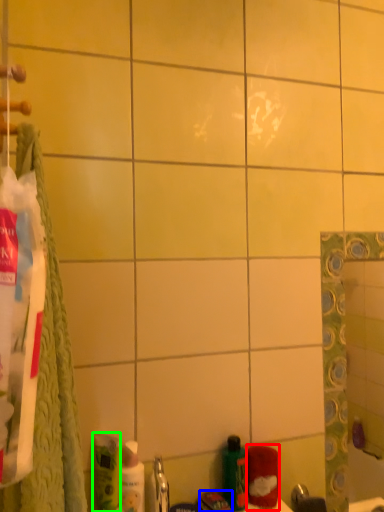
Question: Which object is the farthest from cleaning product (highlighted by a red box)? Choose among these: toothpaste (highlighted by a blue box) or mouthwash (highlighted by a green box).

Choices:
 (A) toothpaste
 (B) mouthwash

Answer: (B)